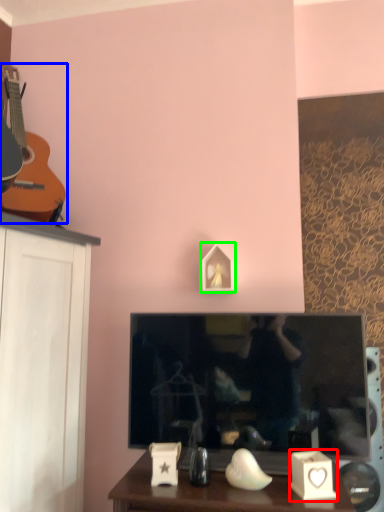
Question: Which object is positioned closest to candle holder (highlighted by a red box)? Select from guitar (highlighted by a blue box) and picture frame (highlighted by a green box).

Choices:
 (A) guitar
 (B) picture frame

Answer: (B)